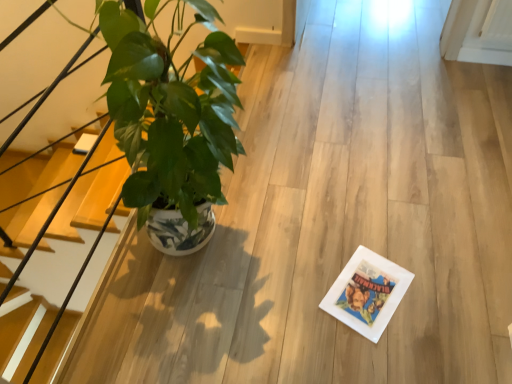
Where is `vacant area that lies between green glossy plant at left and wooden at left`? vacant area that lies between green glossy plant at left and wooden at left is located at coordinates (147, 328).